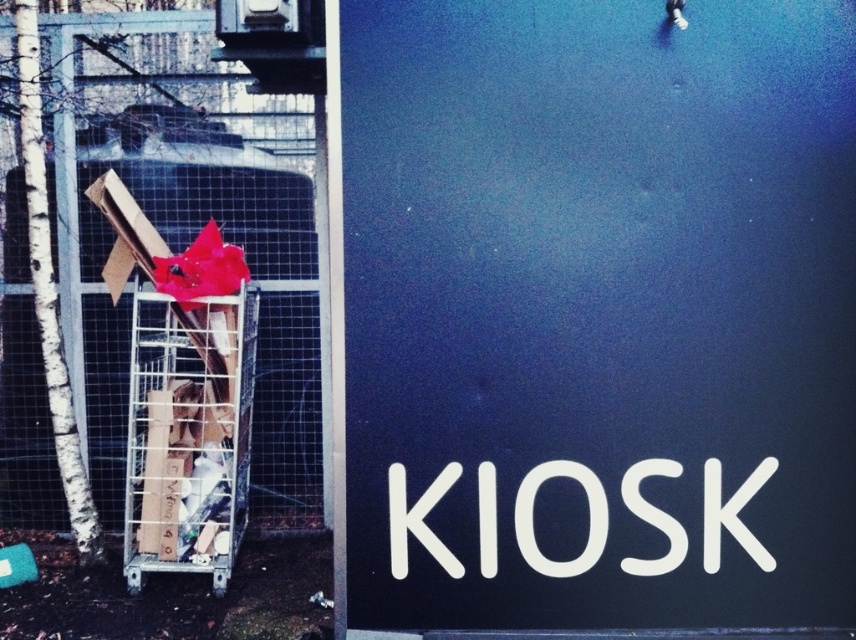
Between black matte sign at center and metal mesh fence at left, which one appears on the left side from the viewer's perspective?

metal mesh fence at left is more to the left.

Which is in front, point (575, 413) or point (278, 376)?

Point (575, 413) is in front.

From the picture: Who is more distant from viewer, (388, 200) or (197, 74)?

The point (197, 74) is behind.

Find the location of a particular element. This screenshot has width=856, height=640. black matte sign at center is located at coordinates (598, 316).

Between point (268, 400) and point (223, 522), which one is positioned behind?

The point (268, 400) is more distant.

Based on the photo, is metal mesh fence at left positioned behind metallic silver shopping cart at left?

Yes, it is behind metallic silver shopping cart at left.

Between point (270, 122) and point (181, 339), which one is positioned behind?

Positioned behind is point (270, 122).

This screenshot has width=856, height=640. What are the coordinates of `metal mesh fence at left` in the screenshot? It's located at (183, 240).

You are a GUI agent. You are given a task and a screenshot of the screen. Output one action in this format:
    pyautogui.click(x=<x>, y=<y>)
    Task: Click on the black matte sign at center
    This screenshot has width=856, height=640.
    Given the screenshot: What is the action you would take?
    pyautogui.click(x=598, y=316)

Is black matte sign at center shorter than metallic silver shopping cart at left?

Incorrect, black matte sign at center's height does not fall short of metallic silver shopping cart at left's.

Is point (524, 468) in front of point (171, 563)?

Yes, point (524, 468) is in front of point (171, 563).

Image resolution: width=856 pixels, height=640 pixels. I want to click on black matte sign at center, so click(x=598, y=316).